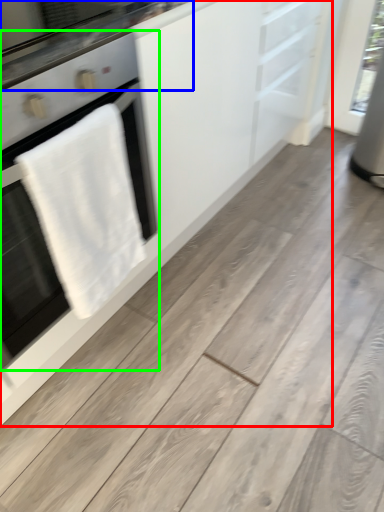
Question: Which object is the farthest from cabinetry (highlighted by a red box)? Choose among these: countertop (highlighted by a blue box) or home appliance (highlighted by a green box).

Choices:
 (A) countertop
 (B) home appliance

Answer: (A)